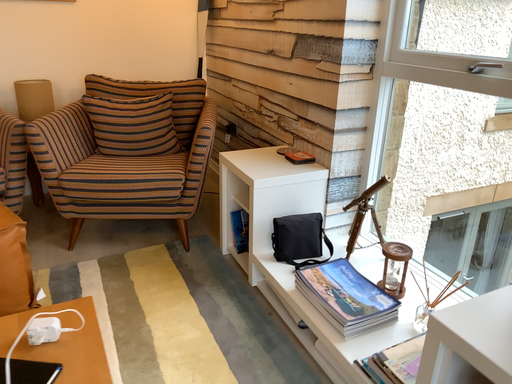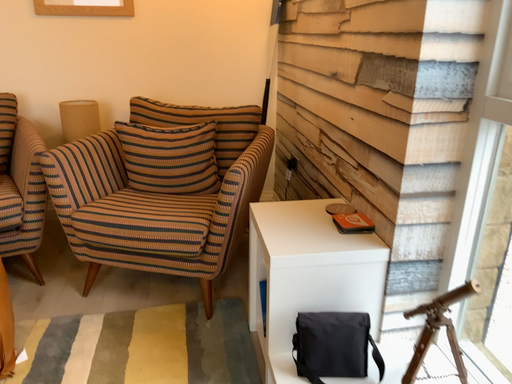
Question: How did the camera likely rotate when shooting the video?

Choices:
 (A) rotated left
 (B) rotated right

Answer: (A)